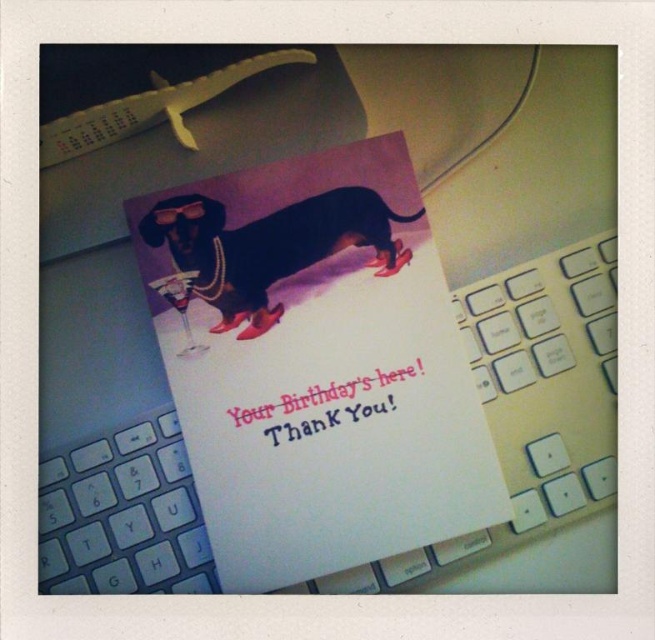
Question: Can you confirm if shiny black dog at center is positioned to the right of pink paper text at center?

Choices:
 (A) yes
 (B) no

Answer: (B)

Question: Which of the following is the farthest from the observer?

Choices:
 (A) pink paper text at center
 (B) shiny black dog at center

Answer: (B)

Question: Is shiny black dog at center below pink paper text at center?

Choices:
 (A) yes
 (B) no

Answer: (B)

Question: Is shiny black dog at center bigger than pink paper text at center?

Choices:
 (A) no
 (B) yes

Answer: (B)

Question: Which point is farther from the camera taking this photo?

Choices:
 (A) (206, 218)
 (B) (405, 378)

Answer: (A)